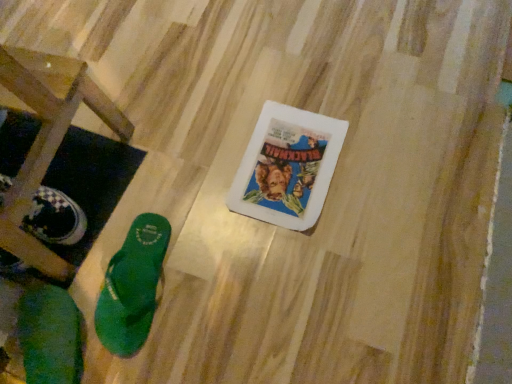
Where is `unoccupied space behind green rubber flip-flop at lower left, acting as the 2th footwear starting from the left`? unoccupied space behind green rubber flip-flop at lower left, acting as the 2th footwear starting from the left is located at coordinates (137, 190).